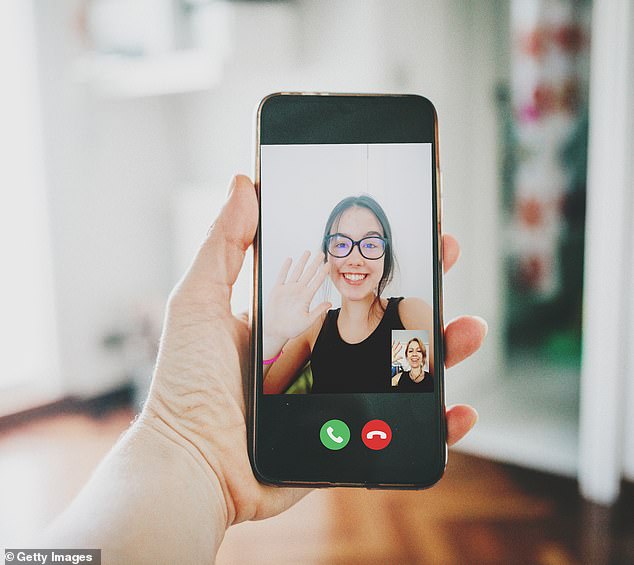
Locate an element on the screen. phone is located at coordinates (385, 111).